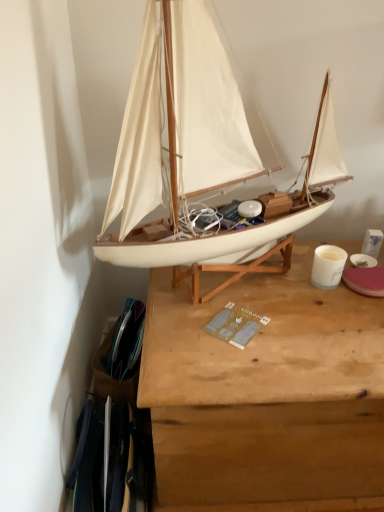
The height and width of the screenshot is (512, 384). Identify the location of vacant region above wooden desk at center (from a real-world perspective). (294, 305).